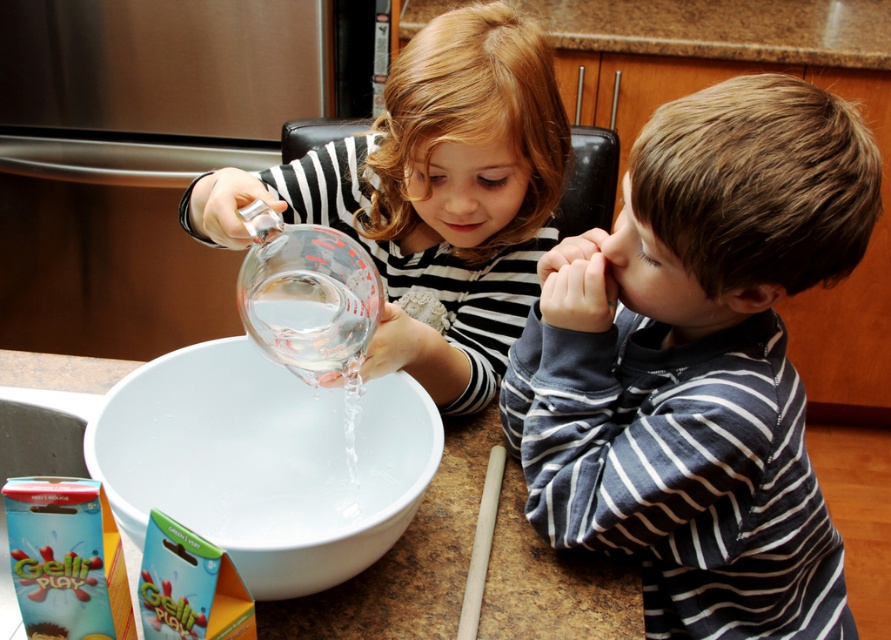
Question: Is dark blue striped shirt at right to the right of transparent glass measuring cup at upper center from the viewer's perspective?

Choices:
 (A) yes
 (B) no

Answer: (A)

Question: Does dark blue striped shirt at right come in front of transparent glass measuring cup at upper center?

Choices:
 (A) no
 (B) yes

Answer: (B)

Question: Among these points, which one is farthest from the camera?

Choices:
 (A) (137, 385)
 (B) (473, 196)

Answer: (B)

Question: Which object is positioned closest to the transparent glass measuring cup at upper center?

Choices:
 (A) dark blue striped shirt at right
 (B) white glossy bowl at center

Answer: (B)

Question: Among these objects, which one is farthest from the camera?

Choices:
 (A) white glossy bowl at center
 (B) dark blue striped shirt at right

Answer: (A)

Question: Can you confirm if dark blue striped shirt at right is positioned to the right of transparent glass measuring cup at upper center?

Choices:
 (A) no
 (B) yes

Answer: (B)